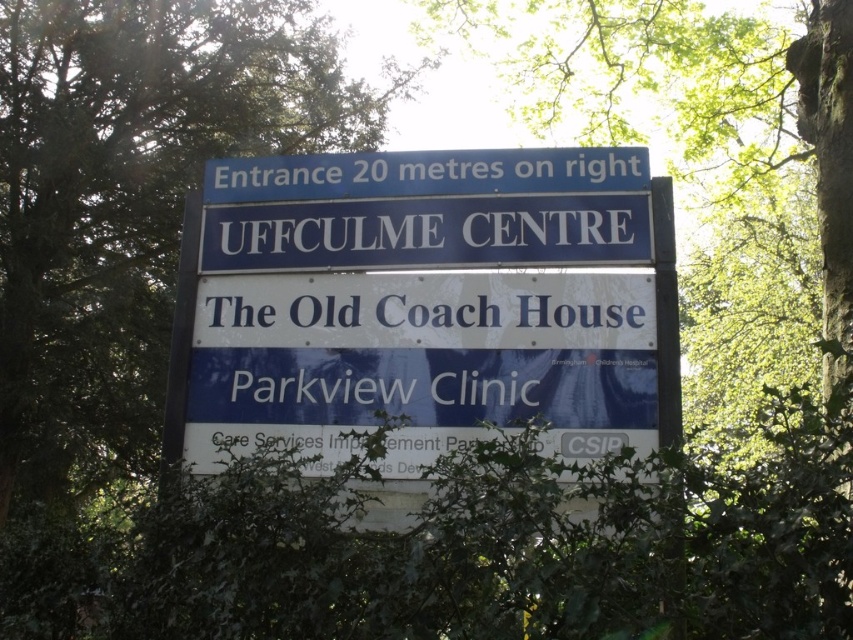
You are standing in front of the signboard and want to know which part of the signboard is taller. Which one is taller between the blue plastic sign at center and the white painted signboard at center?

The blue plastic sign at center is much taller than the white painted signboard at center.

You are standing in front of the signboard and want to know which part of the sign has more vertical space. Which one is taller between the blue metallic sign at upper center and the white painted signboard at center?

The blue metallic sign at upper center has a greater height compared to the white painted signboard at center, so it is taller.

You are standing in front of the signboard and want to read both the blue plastic sign at center and the white painted signboard at center. Which one is located higher up?

The blue plastic sign at center is above the white painted signboard at center, so it is located higher up.